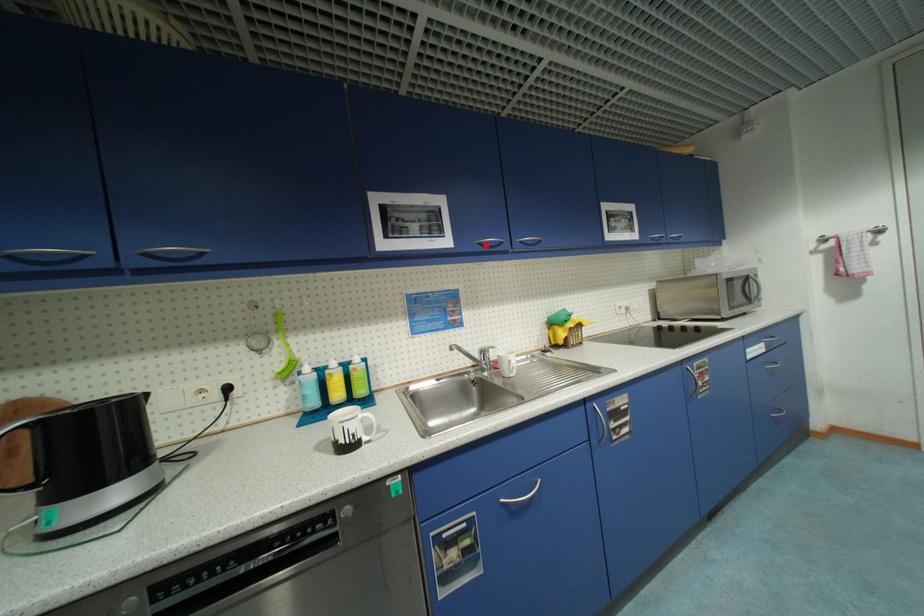
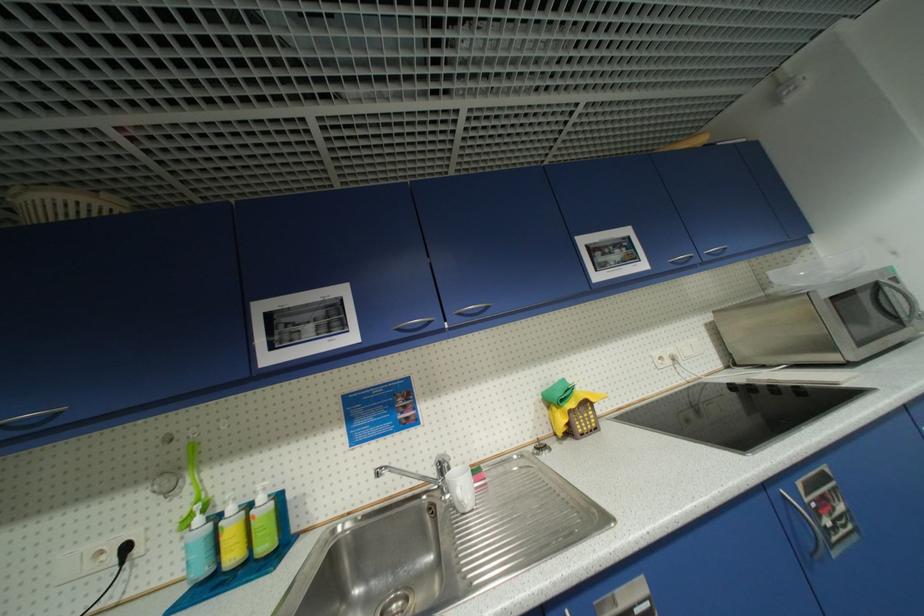
Question: I am providing you with two images of the same scene from different viewpoints. A red point is marked on the first image. Can you still see the location of the red point in image 2?

Choices:
 (A) Yes
 (B) No

Answer: (A)